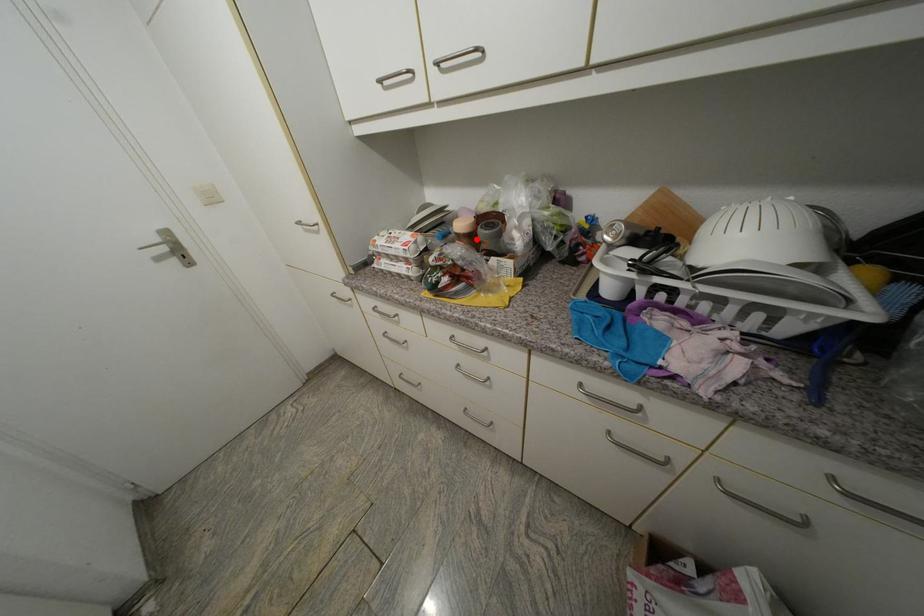
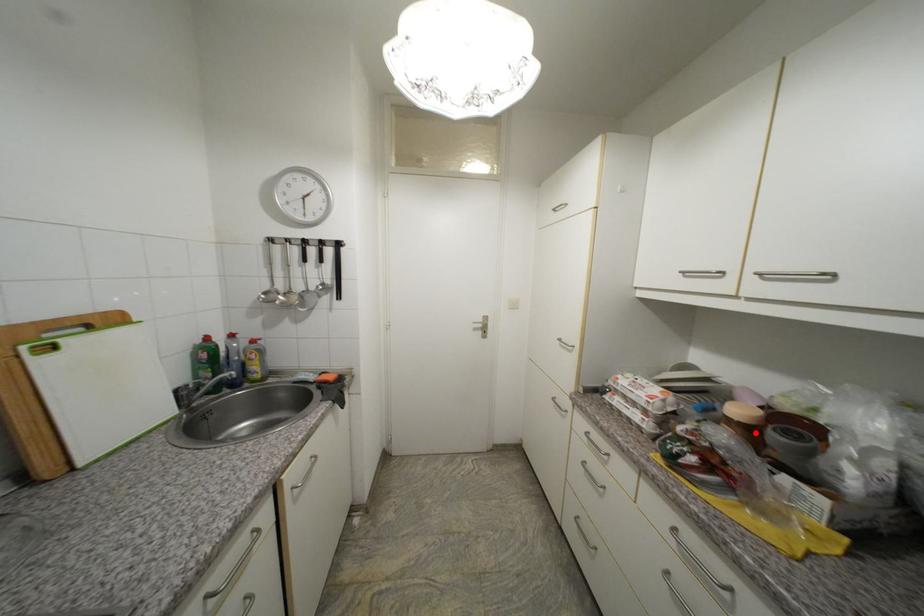
I am providing you with two images of the same scene from different viewpoints. A red point is marked on the first image and another point is marked on the second image. Are the points marked in image1 and image2 representing the same 3D position?

Yes